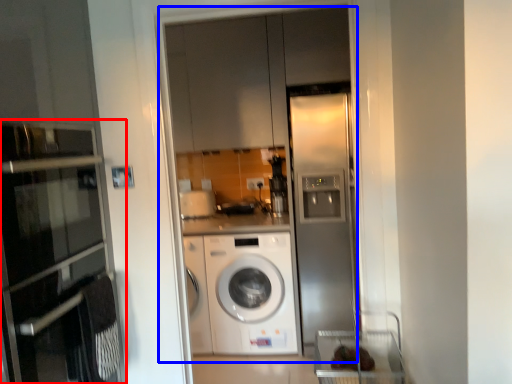
Question: Among these objects, which one is nearest to the camera, oven (highlighted by a red box) or glass door (highlighted by a blue box)?

Choices:
 (A) oven
 (B) glass door

Answer: (A)